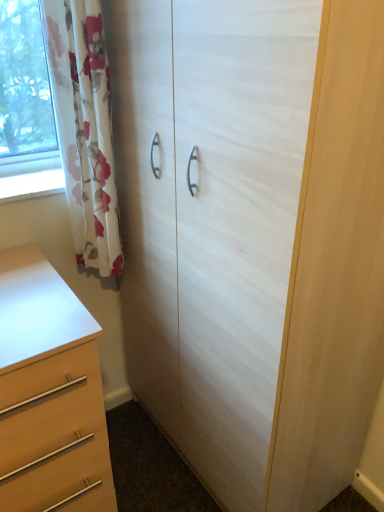
The width and height of the screenshot is (384, 512). Find the location of `free spot above matte wood chest of drawers at lower left (from a real-world perspective)`. free spot above matte wood chest of drawers at lower left (from a real-world perspective) is located at coordinates coord(29,295).